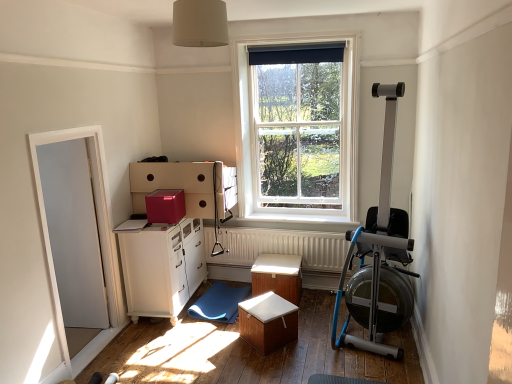
You are a GUI agent. You are given a task and a screenshot of the screen. Output one action in this format:
    pyautogui.click(x=<x>, y=<y>)
    Task: Click on the empty space that is ontop of white textured radiator at center (from a real-world perspective)
    The width and height of the screenshot is (512, 384).
    Given the screenshot: What is the action you would take?
    pyautogui.click(x=283, y=230)